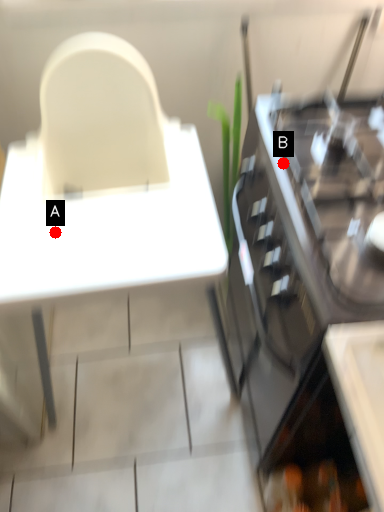
Question: Two points are circled on the image, labeled by A and B beside each circle. Which point is further to the camera?

Choices:
 (A) A is further
 (B) B is further

Answer: (A)